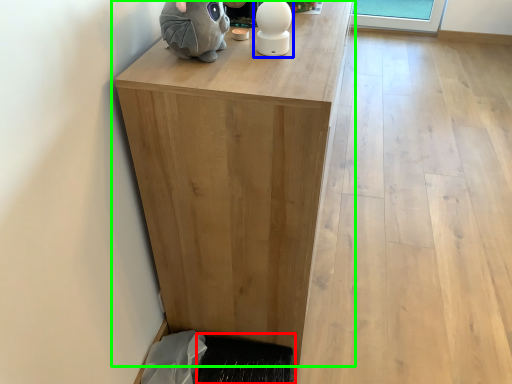
Question: Considering the real-world distances, which object is farthest from doormat (highlighted by a red box)? figurine (highlighted by a blue box) or table (highlighted by a green box)?

Choices:
 (A) figurine
 (B) table

Answer: (A)